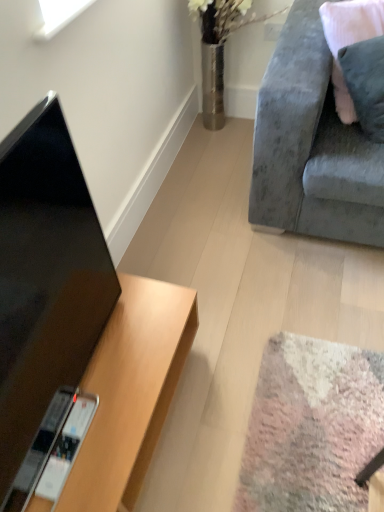
Question: In terms of width, does black glossy tv at left look wider or thinner when compared to velvet pink pillow at upper right?

Choices:
 (A) wide
 (B) thin

Answer: (B)

Question: From a real-world perspective, is black glossy tv at left above or below velvet pink pillow at upper right?

Choices:
 (A) above
 (B) below

Answer: (A)

Question: Which is nearer to the velvet grey couch at upper right?

Choices:
 (A) black glossy tv at left
 (B) wooden desk at lower left
 (C) velvet pink pillow at upper right

Answer: (C)

Question: Which of these objects is positioned closest to the velvet grey couch at upper right?

Choices:
 (A) wooden desk at lower left
 (B) black glossy tv at left
 (C) velvet pink pillow at upper right

Answer: (C)